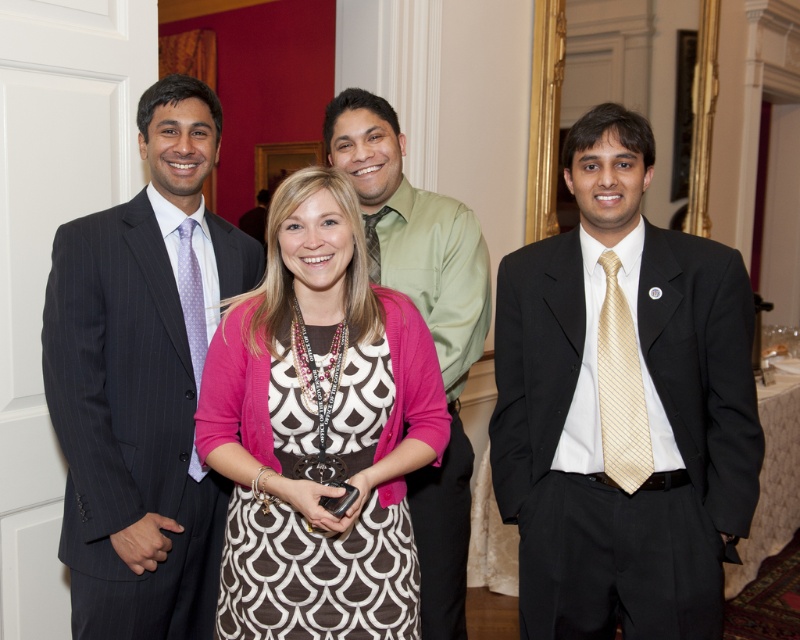
Question: Estimate the real-world distances between objects in this image. Which object is closer to the patterned fabric dress at center?

Choices:
 (A) purple dotted tie at left
 (B) matte black suit at center
 (C) matte black suit at left
 (D) green matte shirt at center

Answer: (C)

Question: Considering the real-world distances, which object is closest to the matte gray tie at center?

Choices:
 (A) gold striped tie at right
 (B) matte black suit at center

Answer: (A)

Question: Does patterned fabric dress at center appear under matte black suit at left?

Choices:
 (A) no
 (B) yes

Answer: (B)

Question: Which point is closer to the camera taking this photo?

Choices:
 (A) (424, 362)
 (B) (588, 518)

Answer: (A)

Question: Can you confirm if purple dotted tie at left is positioned to the right of matte gray tie at center?

Choices:
 (A) no
 (B) yes

Answer: (A)

Question: Does green matte shirt at center lie behind gold striped tie at right?

Choices:
 (A) no
 (B) yes

Answer: (B)